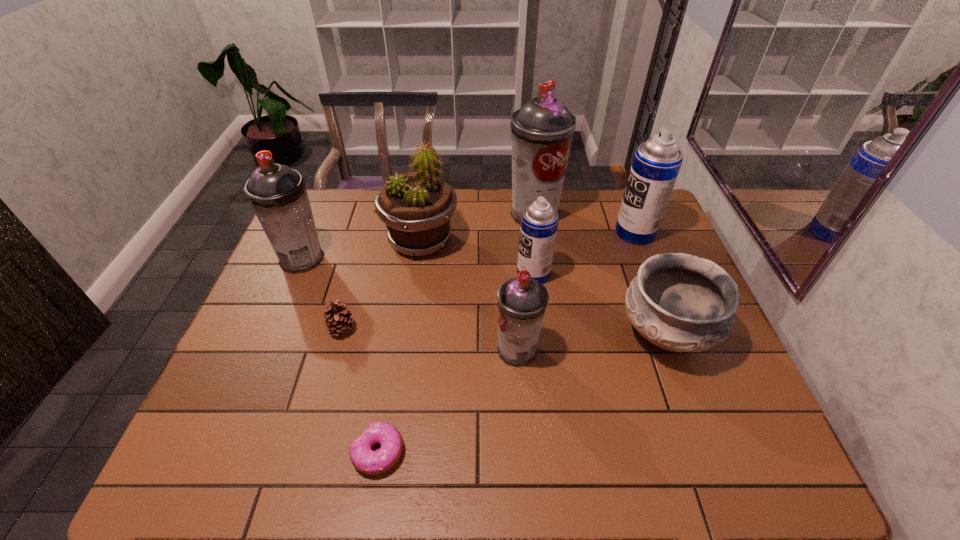
At what (x,y) coordinates should I click in order to perform the action: click on object that is at the near edge. Please return your answer as a coordinate pair (x, y). Looking at the image, I should click on (363, 458).

The height and width of the screenshot is (540, 960). I want to click on object present at the left edge, so click(278, 195).

Where is `aerosol can positioned at the right edge`? The image size is (960, 540). aerosol can positioned at the right edge is located at coordinates (656, 163).

Locate an element on the screen. pottery that is positioned at the right edge is located at coordinates (680, 302).

At what (x,y) coordinates should I click in order to perform the action: click on object positioned at the far right corner. Please return your answer as a coordinate pair (x, y). Image resolution: width=960 pixels, height=540 pixels. Looking at the image, I should click on (656, 163).

Where is `free space at the far edge`? This screenshot has height=540, width=960. free space at the far edge is located at coordinates (492, 219).

Where is `free region at the left edge of the desktop`? Image resolution: width=960 pixels, height=540 pixels. free region at the left edge of the desktop is located at coordinates (246, 366).

Locate an element on the screen. vacant region at the right edge of the desktop is located at coordinates (721, 374).

In the image, there is a desktop. Identify the location of free space at the far left corner. (330, 210).

At what (x,y) coordinates should I click in order to perform the action: click on free space between the pinecone and the leftmost gray aerosol can. Please return your answer as a coordinate pair (x, y). Looking at the image, I should click on (323, 294).